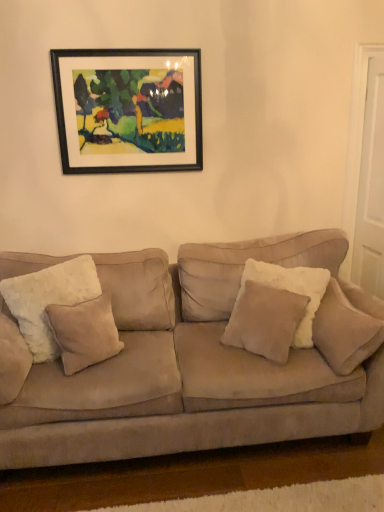
The width and height of the screenshot is (384, 512). Find the location of `blank space situated above black wood picture frame at upper center (from a real-world perspective)`. blank space situated above black wood picture frame at upper center (from a real-world perspective) is located at coordinates (125, 49).